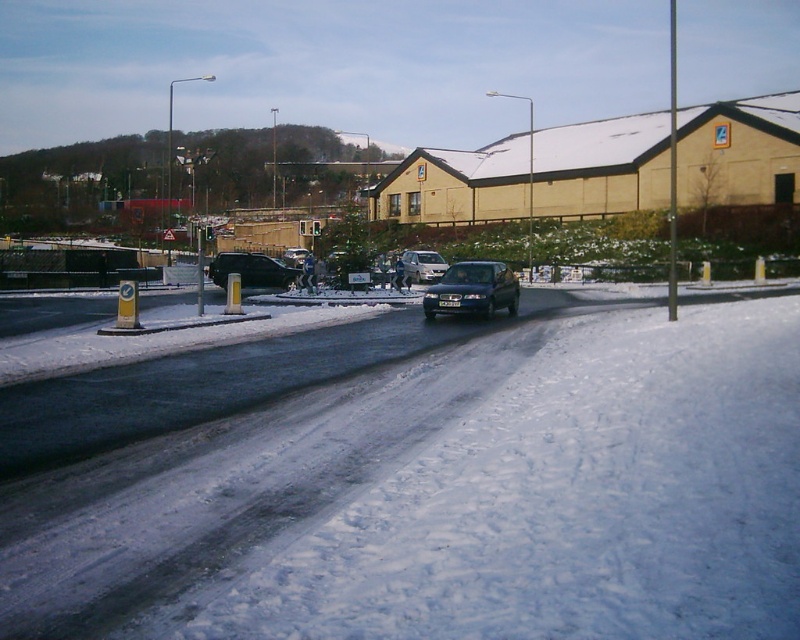
Who is shorter, glossy dark blue car at center or satin silver van at center?

Standing shorter between the two is satin silver van at center.

Does glossy dark blue car at center appear on the right side of satin silver van at center?

Correct, you'll find glossy dark blue car at center to the right of satin silver van at center.

Between point (441, 312) and point (412, 280), which one is positioned behind?

Positioned behind is point (412, 280).

You are a GUI agent. You are given a task and a screenshot of the screen. Output one action in this format:
    pyautogui.click(x=<x>, y=<y>)
    Task: Click on the glossy dark blue car at center
    The height and width of the screenshot is (640, 800).
    Given the screenshot: What is the action you would take?
    pyautogui.click(x=472, y=291)

Is satin silver van at center in front of shiny black sedan at center?

Yes, satin silver van at center is in front of shiny black sedan at center.

Is satin silver van at center to the right of shiny black sedan at center from the viewer's perspective?

Yes, satin silver van at center is to the right of shiny black sedan at center.

Does point (417, 282) come closer to viewer compared to point (284, 257)?

Yes, it is.

Find the location of a particular element. The image size is (800, 640). satin silver van at center is located at coordinates (422, 266).

Is glossy dark blue car at center wider than shiny black car at center?

No.

What are the coordinates of `glossy dark blue car at center` in the screenshot? It's located at (472, 291).

Find the location of a particular element. This screenshot has height=640, width=800. glossy dark blue car at center is located at coordinates (472, 291).